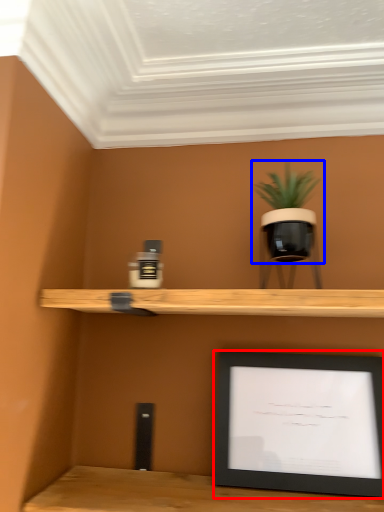
Question: Which point is further to the camera, picture frame (highlighted by a red box) or houseplant (highlighted by a blue box)?

Choices:
 (A) picture frame
 (B) houseplant

Answer: (A)